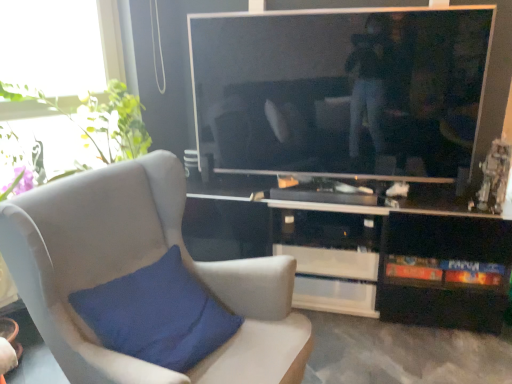
Question: Could suede-like beige chair at left be considered to be inside black glossy cabinet at lower right?

Choices:
 (A) no
 (B) yes

Answer: (A)

Question: Could you tell me if black glossy cabinet at lower right is turned towards suede-like beige chair at left?

Choices:
 (A) yes
 (B) no

Answer: (A)

Question: Is black glossy cabinet at lower right at the right side of suede-like beige chair at left?

Choices:
 (A) no
 (B) yes

Answer: (B)

Question: Considering the relative positions of black glossy cabinet at lower right and suede-like beige chair at left in the image provided, is black glossy cabinet at lower right behind suede-like beige chair at left?

Choices:
 (A) no
 (B) yes

Answer: (B)

Question: Is black glossy cabinet at lower right wider than suede-like beige chair at left?

Choices:
 (A) no
 (B) yes

Answer: (A)

Question: In the image, is black glossy cabinet at lower right positioned in front of or behind green leafy plant at upper left?

Choices:
 (A) behind
 (B) front

Answer: (A)

Question: Considering the relative positions of black glossy cabinet at lower right and green leafy plant at upper left in the image provided, is black glossy cabinet at lower right to the left or to the right of green leafy plant at upper left?

Choices:
 (A) right
 (B) left

Answer: (A)

Question: Considering the positions of black glossy cabinet at lower right and green leafy plant at upper left in the image, is black glossy cabinet at lower right bigger or smaller than green leafy plant at upper left?

Choices:
 (A) big
 (B) small

Answer: (A)

Question: From their relative heights in the image, would you say black glossy cabinet at lower right is taller or shorter than green leafy plant at upper left?

Choices:
 (A) tall
 (B) short

Answer: (A)

Question: Is green leafy plant at upper left taller or shorter than suede-like beige chair at left?

Choices:
 (A) short
 (B) tall

Answer: (A)

Question: Looking at their shapes, would you say green leafy plant at upper left is wider or thinner than suede-like beige chair at left?

Choices:
 (A) wide
 (B) thin

Answer: (B)

Question: Looking at the image, does green leafy plant at upper left seem bigger or smaller compared to suede-like beige chair at left?

Choices:
 (A) big
 (B) small

Answer: (B)

Question: From a real-world perspective, is green leafy plant at upper left physically located above or below suede-like beige chair at left?

Choices:
 (A) below
 (B) above

Answer: (B)

Question: Based on their sizes in the image, would you say green leafy plant at upper left is bigger or smaller than black glossy cabinet at lower right?

Choices:
 (A) small
 (B) big

Answer: (A)

Question: From a real-world perspective, is green leafy plant at upper left positioned above or below black glossy cabinet at lower right?

Choices:
 (A) below
 (B) above

Answer: (B)